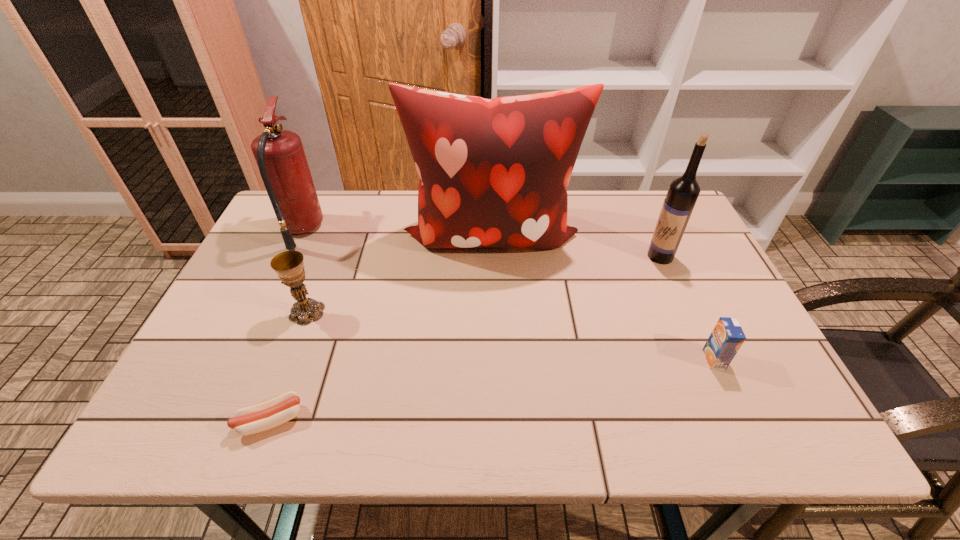
Where is `vacant area located on the front-facing side of the tallest object`? The height and width of the screenshot is (540, 960). vacant area located on the front-facing side of the tallest object is located at coordinates (494, 397).

This screenshot has height=540, width=960. I want to click on free space located 0.160m at the front of the fire extinguisher where the nozzle is aimed, so click(375, 230).

Where is `vacant region located 0.330m on the label of the wine bottle`? vacant region located 0.330m on the label of the wine bottle is located at coordinates (530, 256).

Identify the location of blank space located on the label of the wine bottle. [x=612, y=256].

At what (x,y) coordinates should I click in order to perform the action: click on free space located on the label of the wine bottle. Please return your answer as a coordinate pair (x, y). Looking at the image, I should click on tap(523, 256).

Find the location of a particular element. vacant space located on the back of the fourth farthest object is located at coordinates (342, 219).

Locate an element on the screen. This screenshot has width=960, height=540. free space located 0.080m on the right of the orange_juice is located at coordinates (758, 359).

You are a GUI agent. You are given a task and a screenshot of the screen. Output one action in this format:
    pyautogui.click(x=<x>, y=<y>)
    Task: Click on the free space located on the back of the sausage
    The height and width of the screenshot is (540, 960).
    Given the screenshot: What is the action you would take?
    pyautogui.click(x=321, y=285)

The image size is (960, 540). I want to click on cushion that is at the far edge, so click(x=493, y=172).

You are a GUI agent. You are given a task and a screenshot of the screen. Output one action in this format:
    pyautogui.click(x=<x>, y=<y>)
    Task: Click on the fire extinguisher situated at the far edge
    The image size is (960, 540).
    Given the screenshot: What is the action you would take?
    pyautogui.click(x=282, y=163)